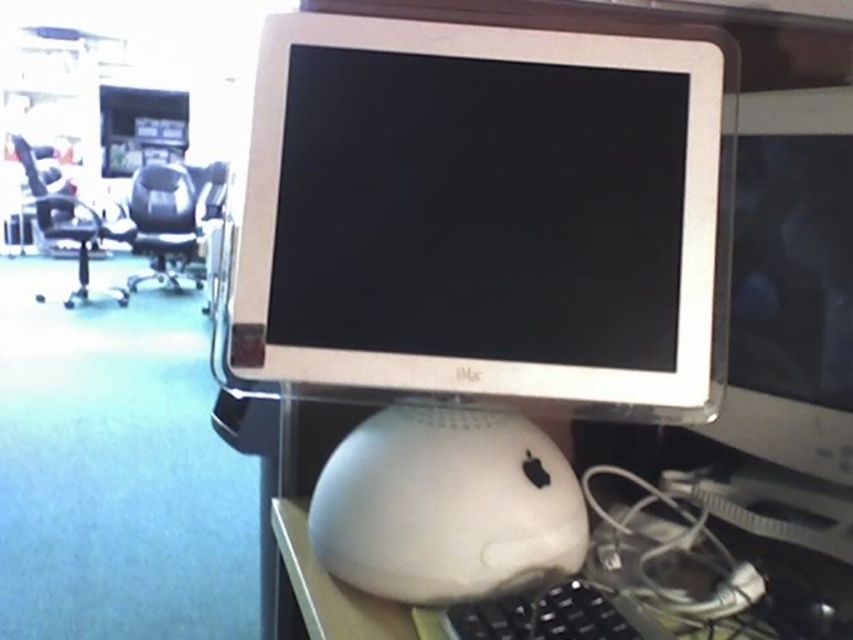
Which is above, white plastic monitor at center or white matte mouse at center?

white plastic monitor at center is above.

Is white plastic monitor at center to the left of white matte mouse at center from the viewer's perspective?

Incorrect, white plastic monitor at center is not on the left side of white matte mouse at center.

Between point (575, 289) and point (498, 541), which one is positioned behind?

The point (575, 289) is behind.

Locate an element on the screen. The height and width of the screenshot is (640, 853). white plastic monitor at center is located at coordinates (489, 212).

Does white matte mouse at center have a greater width compared to white plastic table at lower center?

Yes.

In the scene shown: Is white matte mouse at center closer to the viewer compared to white plastic table at lower center?

No, it is not.

Is point (535, 563) closer to viewer compared to point (277, 611)?

That is True.

Locate an element on the screen. white matte mouse at center is located at coordinates (445, 506).

Which is in front, point (577, 618) or point (32, 186)?

Positioned in front is point (577, 618).

What do you see at coordinates (550, 618) in the screenshot? The image size is (853, 640). I see `black plastic keyboard at lower center` at bounding box center [550, 618].

You are a GUI agent. You are given a task and a screenshot of the screen. Output one action in this format:
    pyautogui.click(x=<x>, y=<y>)
    Task: Click on the black plastic keyboard at lower center
    
    Given the screenshot: What is the action you would take?
    pyautogui.click(x=550, y=618)